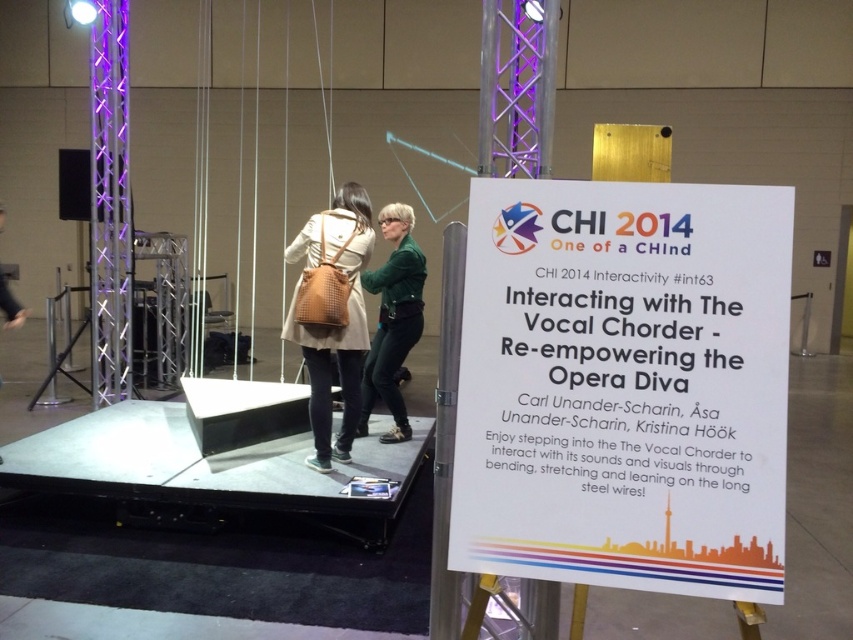
You are at the CHI 2014 conference exhibit and need to locate the white paper sign at center and the matte brown leather backpack at center. From the perspective of someone standing in front of the exhibit, which object is positioned higher?

The matte brown leather backpack at center is positioned higher than the white paper sign at center because the white paper sign at center is below the matte brown leather backpack at center.